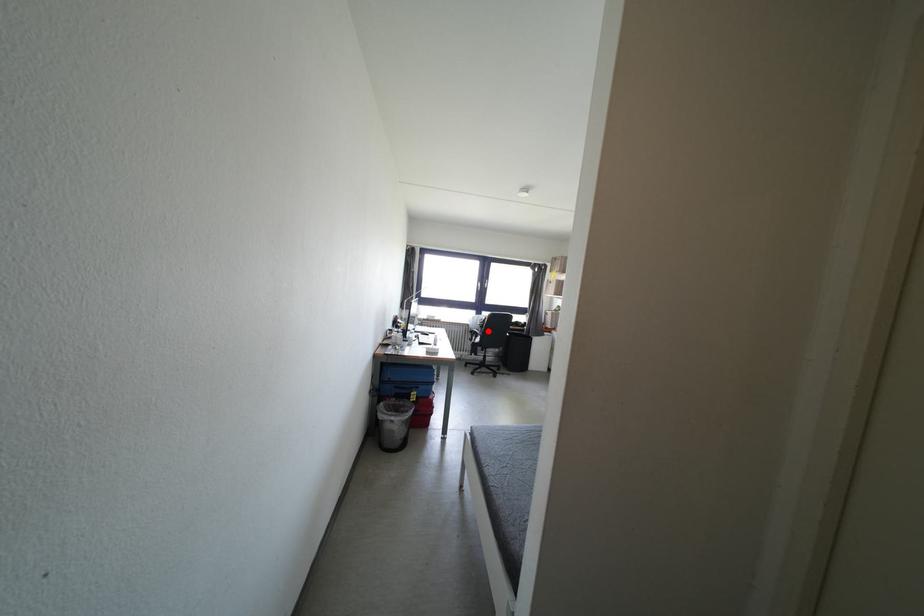
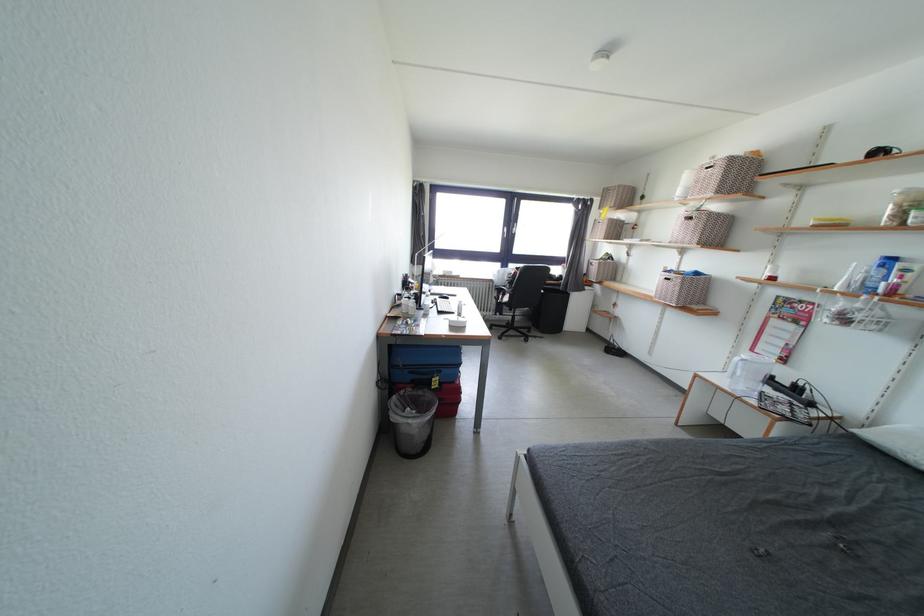
Question: I am providing you with two images of the same scene from different viewpoints. In image1, a red point is highlighted. Considering the same 3D point in image2, which of the following is correct?

Choices:
 (A) It is closer
 (B) It is farther

Answer: (A)